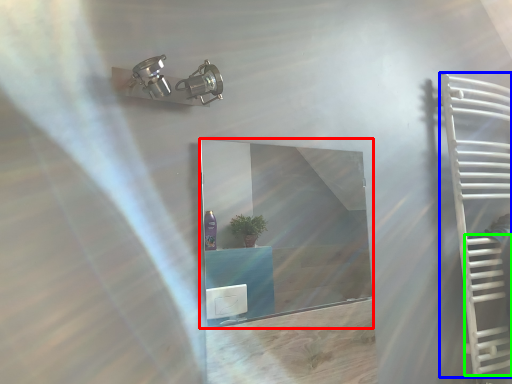
Question: Which is farther away from mirror (highlighted by a red box)? ladder (highlighted by a blue box) or stairs (highlighted by a green box)?

Choices:
 (A) ladder
 (B) stairs

Answer: (B)